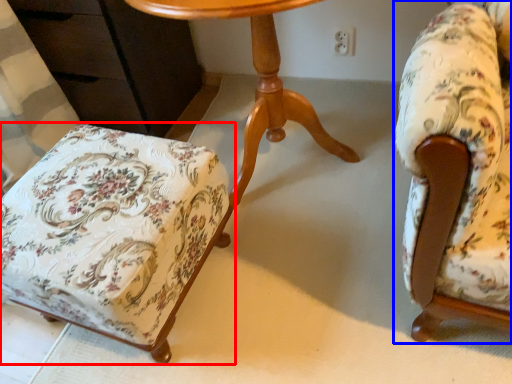
Question: Among these objects, which one is nearest to the camera, chair (highlighted by a red box) or chair (highlighted by a blue box)?

Choices:
 (A) chair
 (B) chair

Answer: (B)